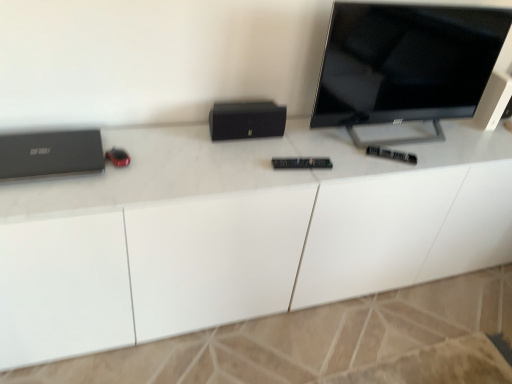
Question: From a real-world perspective, does black matte speaker at upper right stand above white glossy desk at center?

Choices:
 (A) no
 (B) yes

Answer: (B)

Question: Does black matte speaker at upper right have a larger size compared to white glossy desk at center?

Choices:
 (A) yes
 (B) no

Answer: (B)

Question: From the image's perspective, is black matte speaker at upper right located above white glossy desk at center?

Choices:
 (A) yes
 (B) no

Answer: (A)

Question: Does black matte speaker at upper right come behind white glossy desk at center?

Choices:
 (A) no
 (B) yes

Answer: (B)

Question: Is black matte speaker at upper right touching white glossy desk at center?

Choices:
 (A) yes
 (B) no

Answer: (B)

Question: Considering the relative sizes of black matte speaker at upper right and white glossy desk at center in the image provided, is black matte speaker at upper right thinner than white glossy desk at center?

Choices:
 (A) yes
 (B) no

Answer: (A)

Question: Does black matte speaker at center come behind matte black laptop at left?

Choices:
 (A) no
 (B) yes

Answer: (B)

Question: Are black matte speaker at center and matte black laptop at left located far from each other?

Choices:
 (A) yes
 (B) no

Answer: (B)

Question: Is black matte speaker at center completely or partially outside of matte black laptop at left?

Choices:
 (A) no
 (B) yes

Answer: (B)

Question: From a real-world perspective, is black matte speaker at center on top of matte black laptop at left?

Choices:
 (A) no
 (B) yes

Answer: (B)

Question: Is black matte speaker at center to the left of matte black laptop at left from the viewer's perspective?

Choices:
 (A) yes
 (B) no

Answer: (B)

Question: Does black matte speaker at center have a lesser width compared to matte black laptop at left?

Choices:
 (A) yes
 (B) no

Answer: (A)

Question: Could you tell me if white glossy desk at center is facing black glossy tv at upper right?

Choices:
 (A) yes
 (B) no

Answer: (B)